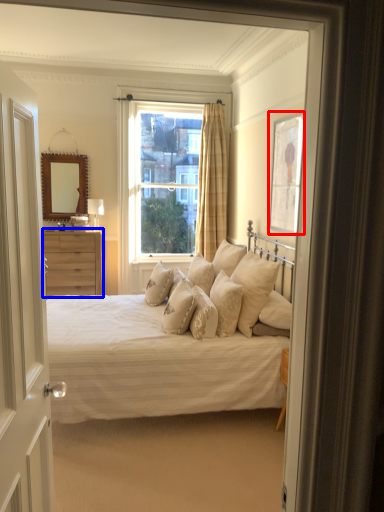
Question: Which of the following is the closest to the observer, picture frame (highlighted by a red box) or chest of drawers (highlighted by a blue box)?

Choices:
 (A) picture frame
 (B) chest of drawers

Answer: (A)